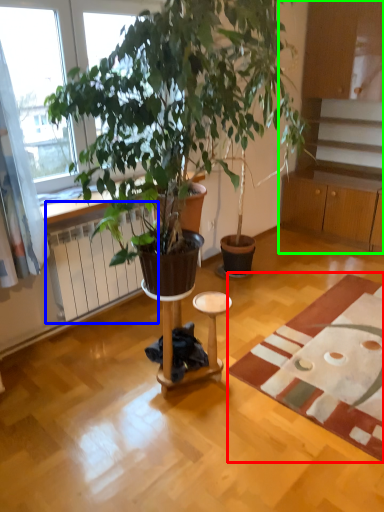
Question: Which is nearer to the mat (highlighted by a red box)? radiator (highlighted by a blue box) or cabinetry (highlighted by a green box).

Choices:
 (A) radiator
 (B) cabinetry

Answer: (A)